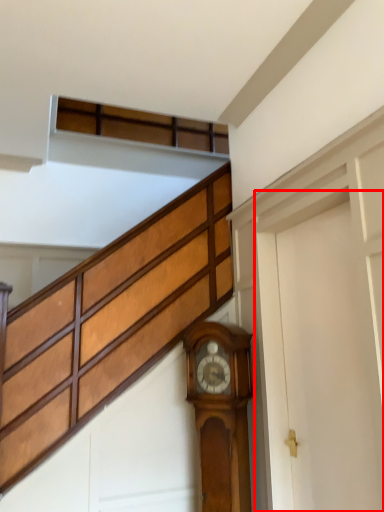
Question: From the image's perspective, what is the correct spatial relationship of garage door (annotated by the red box) in relation to wall clock?

Choices:
 (A) above
 (B) below

Answer: (A)